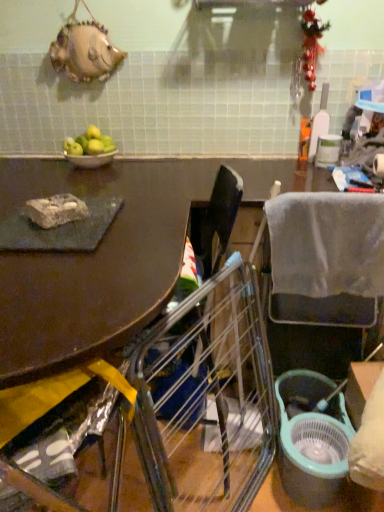
Describe the element at coordinates (56, 210) in the screenshot. I see `rocky stone at left` at that location.

This screenshot has height=512, width=384. What do you see at coordinates (201, 403) in the screenshot?
I see `metallic silver chair at lower left, which appears as the 1th chair when viewed from the front` at bounding box center [201, 403].

The height and width of the screenshot is (512, 384). I want to click on green matte apples at upper left, so click(x=89, y=143).

Identify the location of rocky stone at left. (56, 210).

Looking at their sizes, would you say metallic silver chair at lower left, which appears as the 1th chair when viewed from the front, is wider or thinner than green matte apples at upper left?

Considering their sizes, metallic silver chair at lower left, which appears as the 1th chair when viewed from the front, looks broader than green matte apples at upper left.

Does metallic silver chair at lower left, the second chair when ordered from right to left, turn towards green matte apples at upper left?

No, metallic silver chair at lower left, the second chair when ordered from right to left, is not aimed at green matte apples at upper left.

Who is shorter, metallic silver chair at lower left, the 1th chair viewed from the left, or green matte apples at upper left?

With less height is green matte apples at upper left.

Considering the positions of point (356, 314) and point (90, 132), is point (356, 314) closer or farther from the camera than point (90, 132)?

Point (356, 314) appears to be closer to the viewer than point (90, 132).

Can you tell me how much gray fabric chair at right, the 1th chair in the right-to-left sequence, and green matte apples at upper left differ in facing direction?

0.000333 degrees.

Which of these two, gray fabric chair at right, which ranks as the first chair in back-to-front order, or green matte apples at upper left, is smaller?

Smaller between the two is green matte apples at upper left.

Considering the sizes of gray fabric chair at right, arranged as the second chair when viewed from the front, and green matte apples at upper left in the image, is gray fabric chair at right, arranged as the second chair when viewed from the front, taller or shorter than green matte apples at upper left?

Clearly, gray fabric chair at right, arranged as the second chair when viewed from the front, is taller compared to green matte apples at upper left.

Is metallic silver bowl at upper left next to green matte apples at upper left?

Yes, metallic silver bowl at upper left is right next to green matte apples at upper left and making contact.

From a real-world perspective, which object rests below the other?

metallic silver bowl at upper left.

Considering the sizes of objects metallic silver bowl at upper left and green matte apples at upper left in the image provided, who is thinner, metallic silver bowl at upper left or green matte apples at upper left?

green matte apples at upper left is thinner.

In the image, is rocky stone at left positioned in front of or behind green matte apples at upper left?

In the image, rocky stone at left appears in front of green matte apples at upper left.

At what (x,y) coordinates should I click in order to perform the action: click on fruit behind the rocky stone at left. Please return your answer as a coordinate pair (x, y). Looking at the image, I should click on (89, 143).

From a real-world perspective, is rocky stone at left on top of green matte apples at upper left?

Incorrect, from a real-world perspective, rocky stone at left is lower than green matte apples at upper left.

Considering the points (91, 162) and (54, 219), which point is behind, point (91, 162) or point (54, 219)?

The point (91, 162) is farther.

Is metallic silver bowl at upper left aimed at rocky stone at left?

Yes.

From the picture: From a real-world perspective, is metallic silver bowl at upper left physically below rocky stone at left?

Indeed, from a real-world perspective, metallic silver bowl at upper left is positioned beneath rocky stone at left.

Does metallic silver chair at lower left, the 1th chair viewed from the left, have a smaller size compared to metallic silver bowl at upper left?

No, metallic silver chair at lower left, the 1th chair viewed from the left, is not smaller than metallic silver bowl at upper left.

Is metallic silver chair at lower left, the 1th chair viewed from the left, next to metallic silver bowl at upper left and touching it?

metallic silver chair at lower left, the 1th chair viewed from the left, and metallic silver bowl at upper left are not in contact.

Is metallic silver chair at lower left, arranged as the 2th chair when viewed from the back, facing away from metallic silver bowl at upper left?

No, metallic silver chair at lower left, arranged as the 2th chair when viewed from the back, is not facing the opposite direction of metallic silver bowl at upper left.

Is rocky stone at left wider or thinner than gray fabric chair at right, arranged as the second chair when viewed from the front?

Considering their sizes, rocky stone at left looks slimmer than gray fabric chair at right, arranged as the second chair when viewed from the front.

From the image's perspective, is rocky stone at left positioned above or below gray fabric chair at right, which ranks as the first chair in back-to-front order?

rocky stone at left is above gray fabric chair at right, which ranks as the first chair in back-to-front order.

Is rocky stone at left oriented away from gray fabric chair at right, the 1th chair in the right-to-left sequence?

No, rocky stone at left is not facing away from gray fabric chair at right, the 1th chair in the right-to-left sequence.

This screenshot has height=512, width=384. In order to click on chair that is the 2nd one when counting forward from the green matte apples at upper left in this screenshot , I will do `click(201, 403)`.

Locate an element on the screen. The height and width of the screenshot is (512, 384). the 2nd chair to the right of the green matte apples at upper left, starting your count from the anchor is located at coordinates (322, 277).

From the image, which object appears to be nearer to metallic silver chair at lower left, the 1th chair viewed from the left, gray fabric chair at right, arranged as the second chair when viewed from the front, or rocky stone at left?

gray fabric chair at right, arranged as the second chair when viewed from the front, is closer to metallic silver chair at lower left, the 1th chair viewed from the left.

Looking at this image, when comparing their distances from gray fabric chair at right, which ranks as the first chair in back-to-front order, does rocky stone at left or metallic silver bowl at upper left seem closer?

rocky stone at left is closer to gray fabric chair at right, which ranks as the first chair in back-to-front order.

Looking at the image, which one is located closer to green matte apples at upper left, gray fabric chair at right, the 1th chair in the right-to-left sequence, or metallic silver chair at lower left, the 1th chair viewed from the left?

Based on the image, gray fabric chair at right, the 1th chair in the right-to-left sequence, appears to be nearer to green matte apples at upper left.

Estimate the real-world distances between objects in this image. Which object is closer to metallic silver bowl at upper left, metallic silver chair at lower left, arranged as the 2th chair when viewed from the back, or rocky stone at left?

The object closer to metallic silver bowl at upper left is rocky stone at left.

From the image, which object appears to be nearer to rocky stone at left, metallic silver chair at lower left, the 1th chair viewed from the left, or green matte apples at upper left?

The object closer to rocky stone at left is green matte apples at upper left.

From the image, which object appears to be farther from metallic silver bowl at upper left, rocky stone at left or gray fabric chair at right, the second chair when ordered from left to right?

The object further to metallic silver bowl at upper left is gray fabric chair at right, the second chair when ordered from left to right.

Considering their positions, is metallic silver bowl at upper left positioned further to metallic silver chair at lower left, which appears as the 1th chair when viewed from the front, than gray fabric chair at right, the second chair when ordered from left to right?

metallic silver bowl at upper left is positioned further to the anchor metallic silver chair at lower left, which appears as the 1th chair when viewed from the front.

Estimate the real-world distances between objects in this image. Which object is closer to green matte apples at upper left, metallic silver chair at lower left, arranged as the 2th chair when viewed from the back, or metallic silver bowl at upper left?

Among the two, metallic silver bowl at upper left is located nearer to green matte apples at upper left.

I want to click on chair between metallic silver chair at lower left, the second chair when ordered from right to left, and metallic silver bowl at upper left, along the z-axis, so click(322, 277).

The image size is (384, 512). What are the coordinates of `bowl between green matte apples at upper left and gray fabric chair at right, which ranks as the first chair in back-to-front order, in the horizontal direction` in the screenshot? It's located at (91, 159).

The width and height of the screenshot is (384, 512). I want to click on food located between metallic silver bowl at upper left and gray fabric chair at right, arranged as the second chair when viewed from the front, in the left-right direction, so click(x=56, y=210).

Identify the location of food positioned between metallic silver chair at lower left, the second chair when ordered from right to left, and metallic silver bowl at upper left from near to far. (56, 210).